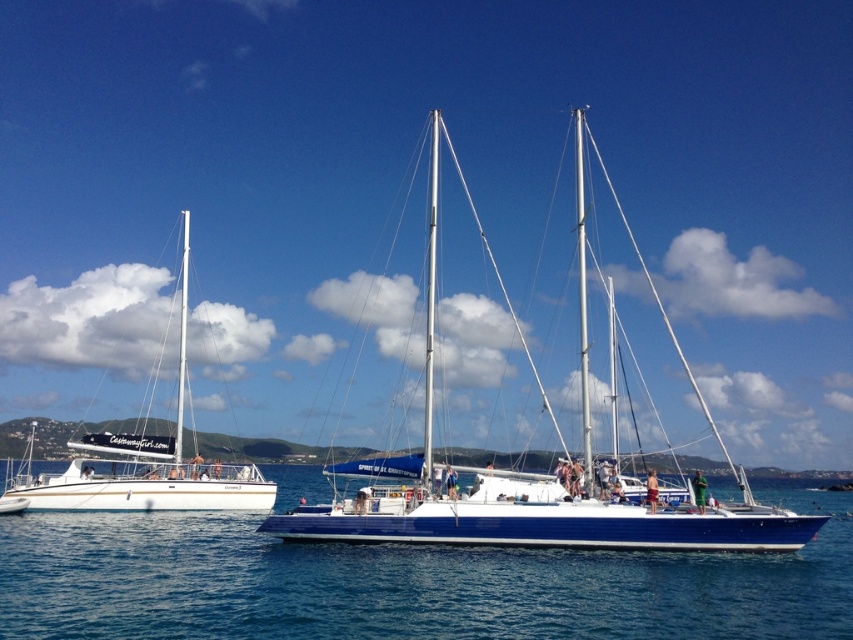
You are a photographer planning to take a photo of the blue glossy sailboat at center and the white glossy sailboat at left. Since you want to emphasize the size difference between them, which boat should you position closer to the camera to achieve this effect?

To emphasize the size difference between the blue glossy sailboat at center and the white glossy sailboat at left, you should position the blue glossy sailboat at center closer to the camera since it is bigger than the white glossy sailboat at left. This will make it appear even larger in comparison.

You are standing on the deck of the larger sailboat and want to locate the blue water at center. According to the coordinates provided, in which direction should you look to see it?

The blue water at center is located at coordinates point (x=405, y=582), so you should look towards the lower right direction from your current position on the deck of the larger sailboat.

You are a sailor on the blue glossy sailboat at center and want to communicate with the crew on the white glossy sailboat at left. Given that the human voice can travel up to 100 meters in calm conditions, can you hear them without using any electronic devices?

The distance between the blue glossy sailboat at center and the white glossy sailboat at left is 77.82 meters, which is within the 100 meters range. Therefore, you can hear them without electronic devices.